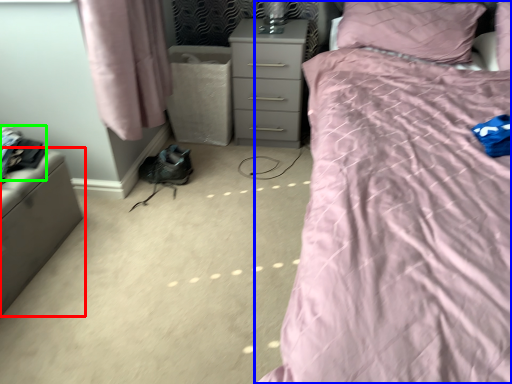
Question: Which object is the farthest from furniture (highlighted by a red box)? Choose among these: bed (highlighted by a blue box) or clothing (highlighted by a green box).

Choices:
 (A) bed
 (B) clothing

Answer: (A)